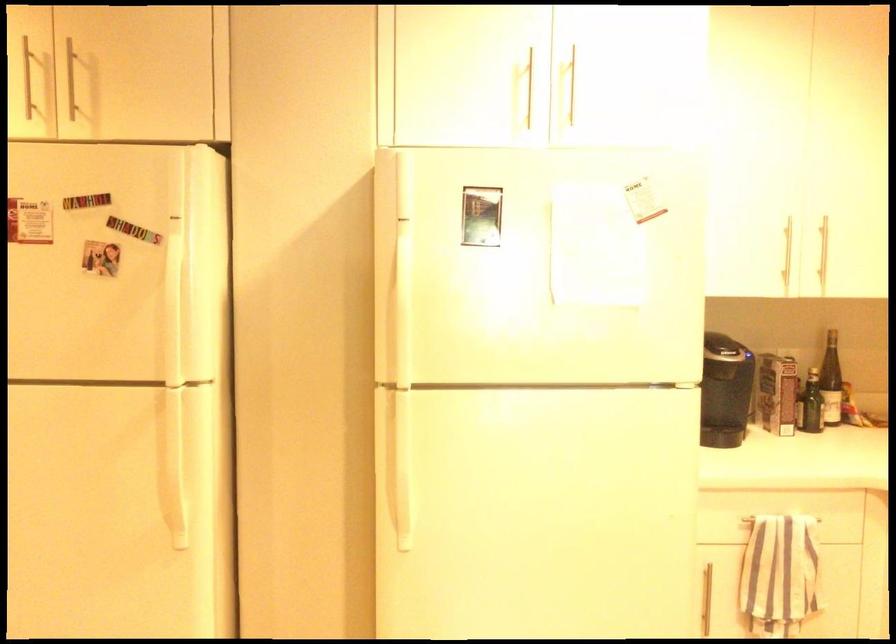
Locate an element on the screen. This screenshot has height=644, width=896. dark wine bottle is located at coordinates (831, 381).